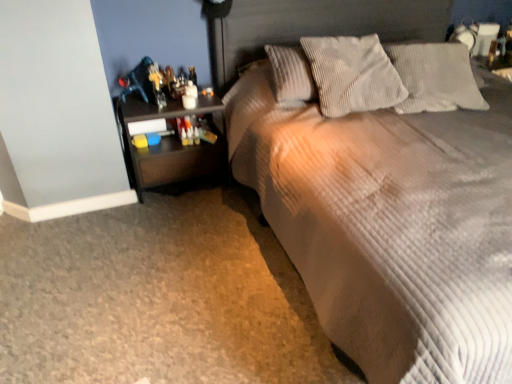
Locate an element on the screen. The image size is (512, 384). free space in front of dark wood nightstand at left is located at coordinates (169, 223).